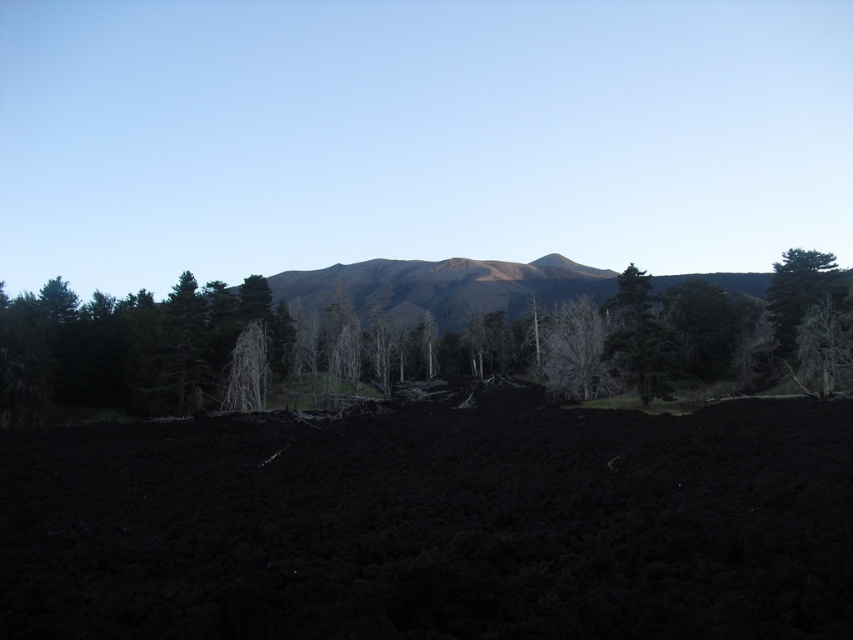
Between dark green textured trees at center and green textured tree at right, which one is positioned higher?

Positioned higher is dark green textured trees at center.

Between point (265, 300) and point (805, 312), which one is positioned behind?

Point (265, 300)

Identify the location of dark green textured trees at center. (286, 323).

Which is more to the left, dark green textured trees at center or white matte tree at center?

Positioned to the left is dark green textured trees at center.

Is point (503, 342) positioned behind point (560, 385)?

Yes, point (503, 342) is behind point (560, 385).

Where is `dark green textured trees at center`? The height and width of the screenshot is (640, 853). dark green textured trees at center is located at coordinates (286, 323).

Which is behind, point (561, 314) or point (839, 294)?

Point (561, 314)

Which is in front, point (579, 330) or point (795, 337)?

Point (795, 337) is more forward.

This screenshot has width=853, height=640. I want to click on white matte tree at center, so click(573, 352).